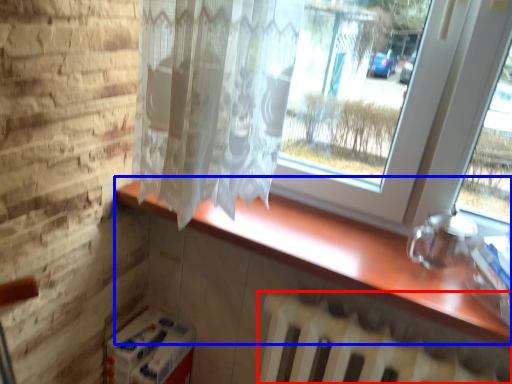
Question: Which object appears farthest to the camera in this image, radiator (highlighted by a red box) or counter top (highlighted by a blue box)?

Choices:
 (A) radiator
 (B) counter top

Answer: (B)